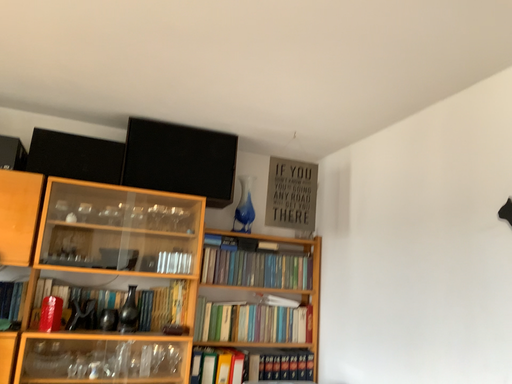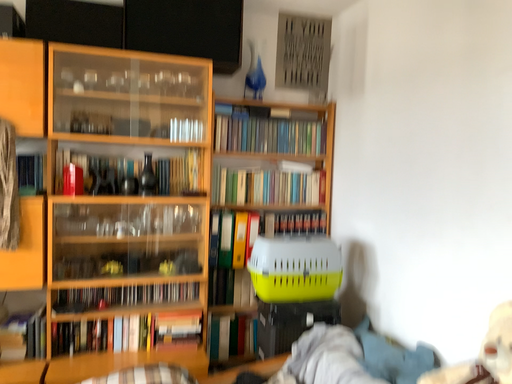
Question: How did the camera likely rotate when shooting the video?

Choices:
 (A) rotated upward
 (B) rotated downward

Answer: (B)